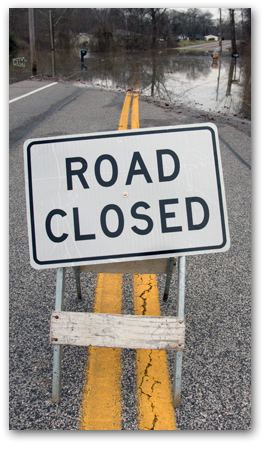
At what (x,y) coordinates should I click in order to perform the action: click on metal legs. Please return your answer as a coordinate pair (x, y). Looking at the image, I should click on (182, 282), (169, 277), (78, 284), (59, 294).